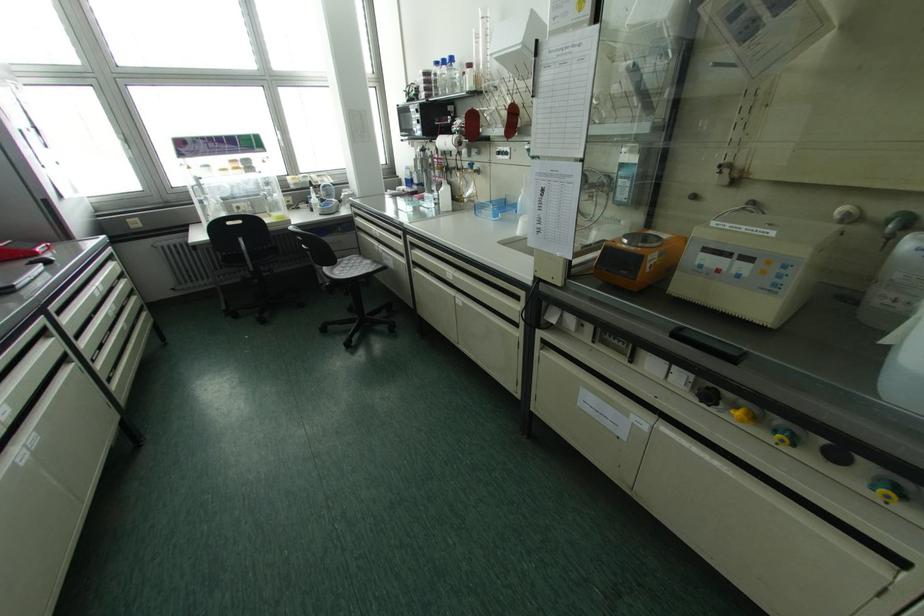
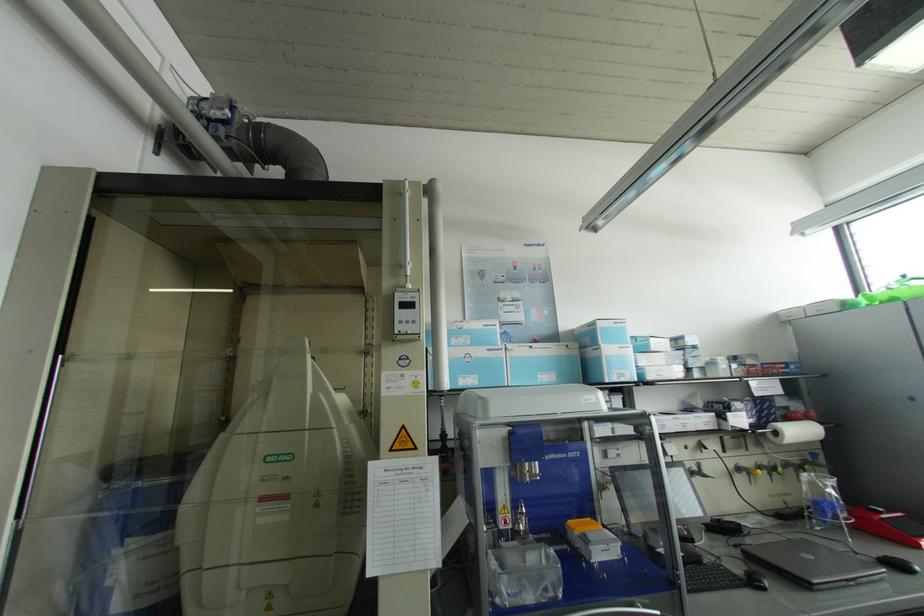
Question: Based on the continuous images, in which direction is the camera rotating? Reply with the corresponding letter.

Choices:
 (A) Left
 (B) Right
 (C) Up
 (D) Down

Answer: (A)